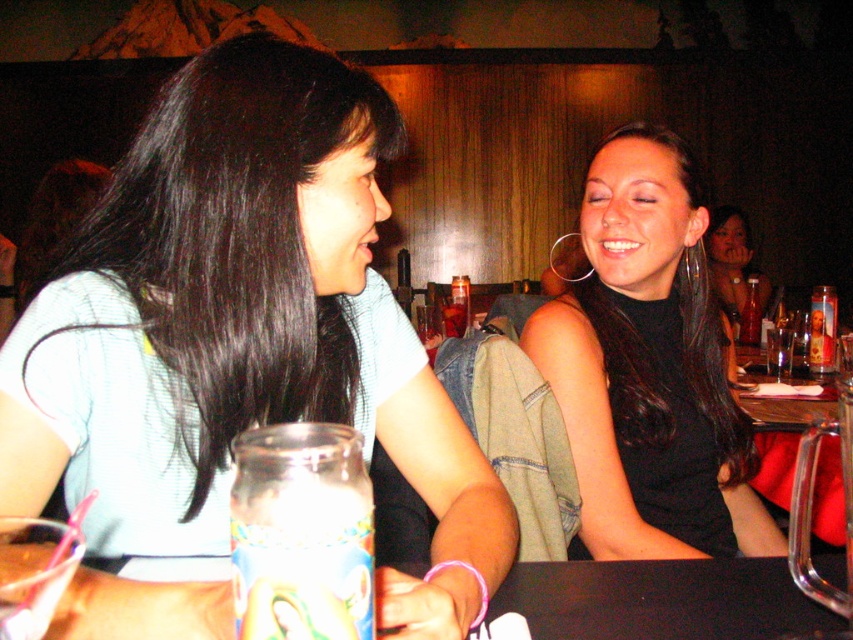
Please describe the location of the black matte dress at center in the image using coordinates.

The black matte dress at center is located at coordinates point (648, 368).

You are a waiter in a restaurant. You need to place a new drink order for the customer wearing the matte black dress at center. Where should you place the drink relative to the black matte table at lower center?

The black matte table at lower center is in front of the matte black dress at center, so you should place the drink on the black matte table at lower center in front of the matte black dress at center.

You are standing in a social setting where two people are seated at a table. You notice a point at coordinate (596, 486). If you want to place a 1.0 meter long object on the table without it extending beyond the table edges, will the space between you and the point allow it? Please consider the distance between you and the point as given.

The distance between you and the point (596, 486) is 1.08 meters. Since the object is 1.0 meters long, it can be placed within that space without exceeding the table edges.